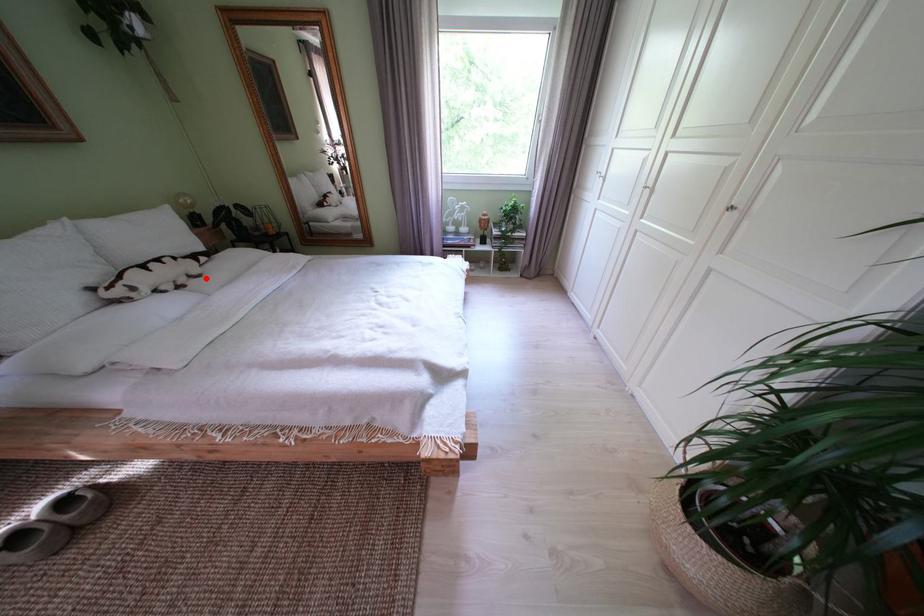
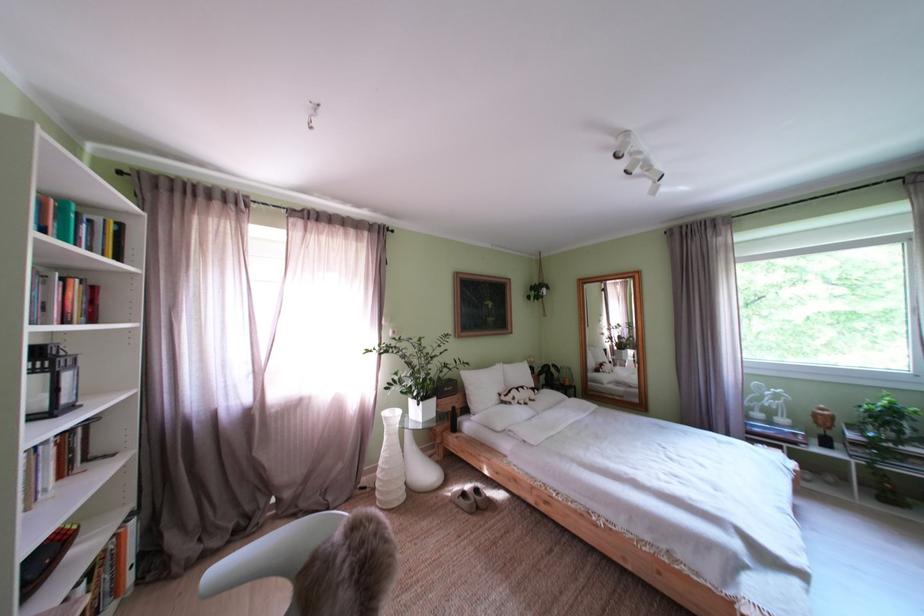
The point at the highlighted location is marked in the first image. Where is the corresponding point in the second image?

(543, 403)